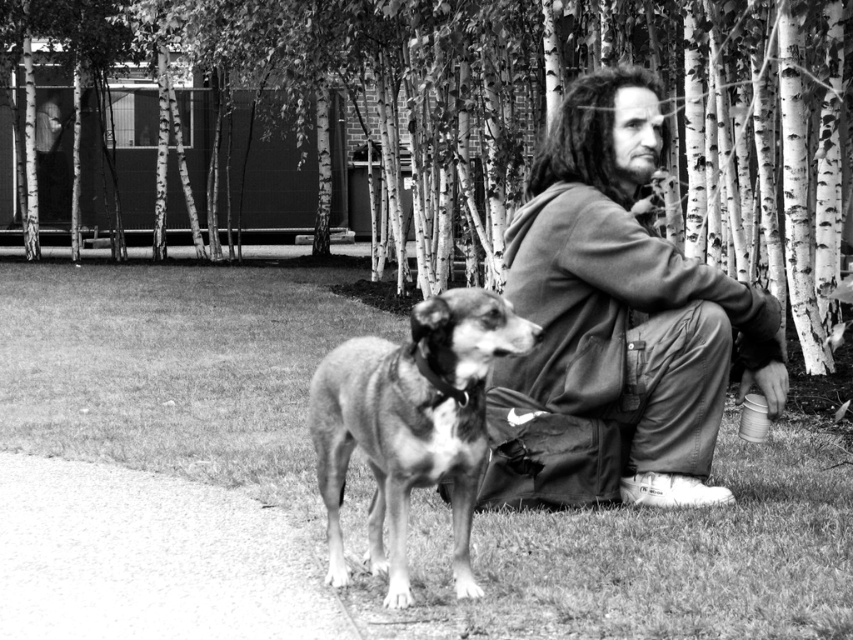
You are trying to decide whether the ripped denim jacket at center can fit into a storage box that is the same width as the spotted fur dog at center. Based on their widths, can the jacket fit inside the box?

The ripped denim jacket at center is wider than the spotted fur dog at center, so it cannot fit into the storage box with the dog width since it is wider.

You are a photographer trying to capture a candid shot of the spotted fur dog at center and the ripped denim jacket at center. Since you want to ensure both subjects are in focus, you need to know which one is taller. Can you tell me which object is taller?

The ripped denim jacket at center has a greater height compared to the spotted fur dog at center, so the ripped denim jacket at center is taller.